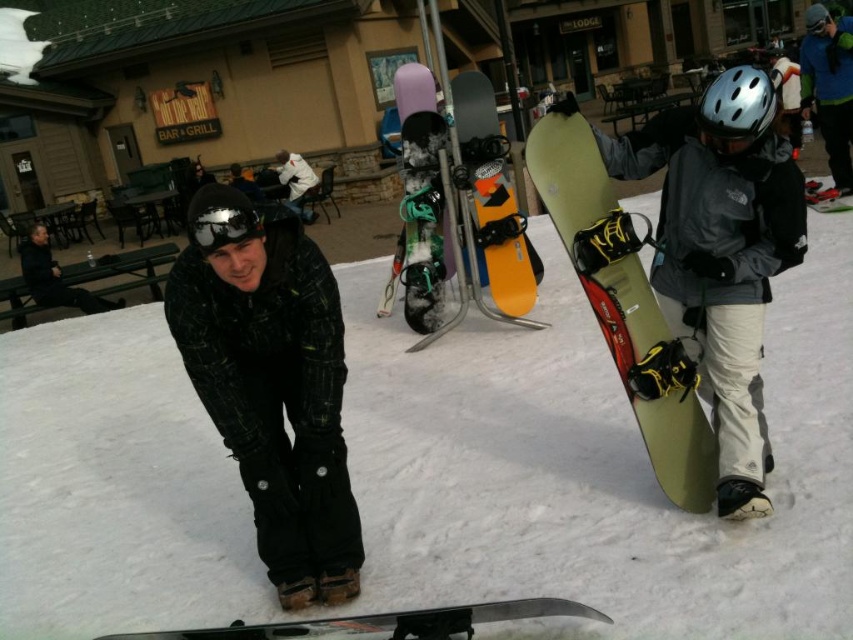
Question: Which of the following is the farthest from the observer?

Choices:
 (A) (84, 308)
 (B) (747, 67)

Answer: (A)

Question: Which point appears closest to the camera in this image?

Choices:
 (A) (722, 97)
 (B) (413, 225)
 (C) (297, 195)
 (D) (227, 225)

Answer: (D)

Question: Is brushed metal helmet at upper right below dark gray jacket at left?

Choices:
 (A) yes
 (B) no

Answer: (B)

Question: Which object is closer to the camera taking this photo?

Choices:
 (A) orange matte snowboard at center
 (B) dark gray jacket at left
 (C) matte black snowboard at lower left
 (D) brushed metal helmet at upper right

Answer: (C)

Question: Can you confirm if brushed metal helmet at upper right is smaller than orange matte snowboard at center?

Choices:
 (A) yes
 (B) no

Answer: (B)

Question: From the image, what is the correct spatial relationship of white matte snowboard at center in relation to silver metallic helmet at upper center?

Choices:
 (A) left
 (B) right

Answer: (A)